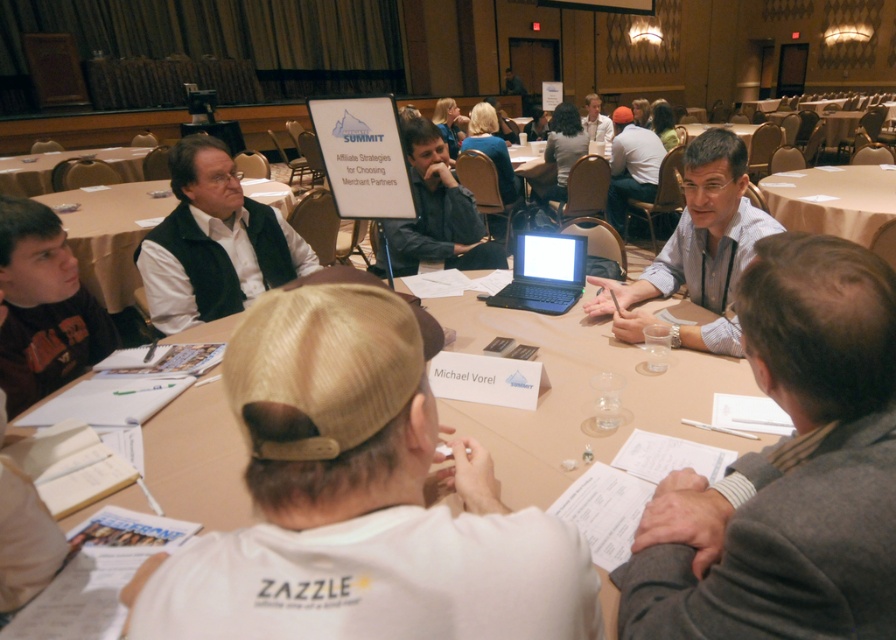
Question: Does white shirt at center come behind light brown wood table at left?

Choices:
 (A) yes
 (B) no

Answer: (B)

Question: Estimate the real-world distances between objects in this image. Which object is farther from the light brown wood table at left?

Choices:
 (A) black plastic laptop at center
 (B) light blue shirt at upper center
 (C) wooden table at center
 (D) matte white table at center

Answer: (C)

Question: Can you confirm if white shirt at center is bigger than wooden table at center?

Choices:
 (A) yes
 (B) no

Answer: (B)

Question: Estimate the real-world distances between objects in this image. Which object is closer to the gray wool sweater at center?

Choices:
 (A) black matte vest at upper left
 (B) light brown wood table at left
 (C) light blue shirt at upper center

Answer: (A)

Question: Which point is farther to the camera?

Choices:
 (A) matte white table at center
 (B) white shirt at center

Answer: (A)

Question: Does light brown wood table at center have a smaller size compared to wooden table at center?

Choices:
 (A) yes
 (B) no

Answer: (B)